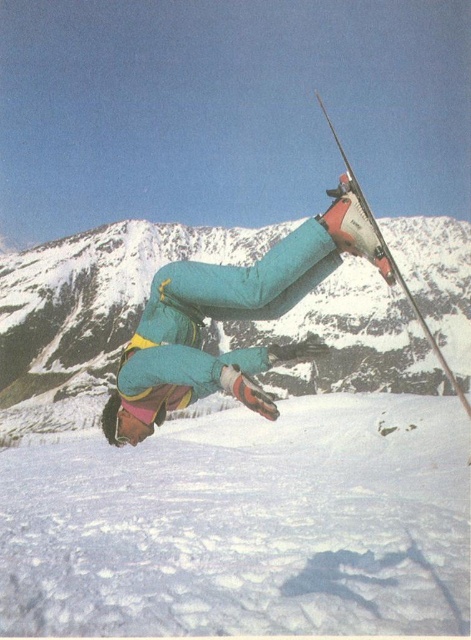
You are a photographer trying to capture the skier midair. You notice the white powdery snow at lower center and the matte red ski at upper right in your camera frame. Which object is closer to your camera lens?

The white powdery snow at lower center is further to the viewer than the matte red ski at upper right, meaning the matte red ski at upper right is closer to the camera lens.

In the scene shown: You are a photographer trying to capture the skier midair. You want to ensure the focus is on the skier while keeping the white powdery snow at lower center in the background. Given that the camera has a depth of field that can only sharply focus on objects within a 0.1 unit radius, will the white powdery snow at lower center be in focus if you focus on the point at coordinates point (244, 525)?

The point (244, 525) corresponds to the white powdery snow at lower center. Therefore, focusing on this point will ensure the white powdery snow at lower center is in focus, as it is the point of focus. The depth of field will also keep nearby areas within the 0.1 unit radius in focus, but since the focus is directly on the snow, it will be sharp.

You are a photographer trying to capture the skier midair. You notice the white powdery snow at lower center and the teal matte snow pants at center. Which object appears closer to the camera based on their relative sizes?

The teal matte snow pants at center appears closer to the camera because it is taller than the white powdery snow at lower center, indicating it is larger in the frame.